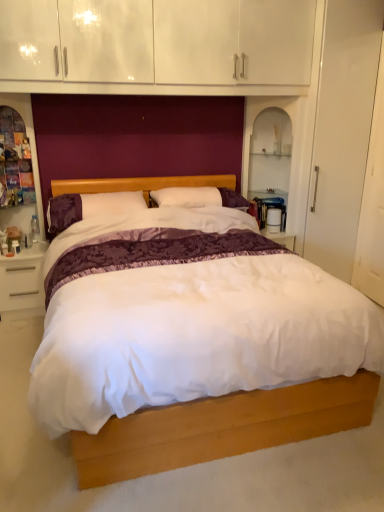
Measure the distance between purple velvet pillow at center and camera.

A distance of 2.96 meters exists between purple velvet pillow at center and camera.

Locate an element on the screen. This screenshot has height=512, width=384. white glossy nightstand at lower left is located at coordinates (22, 279).

From a real-world perspective, is white satin bed at center positioned above or below purple velvet pillow at center?

From a real-world perspective, white satin bed at center is physically below purple velvet pillow at center.

From the image's perspective, is white satin bed at center on top of purple velvet pillow at center?

No, from the image's perspective, white satin bed at center is not above purple velvet pillow at center.

Considering the relative sizes of white satin bed at center and purple velvet pillow at center in the image provided, is white satin bed at center smaller than purple velvet pillow at center?

No, white satin bed at center is not smaller than purple velvet pillow at center.

Is white satin bed at center positioned far away from purple velvet pillow at center?

That's right, there is a large distance between white satin bed at center and purple velvet pillow at center.

Is purple velvet pillow at center not near white satin bed at center?

Indeed, purple velvet pillow at center is not near white satin bed at center.

Image resolution: width=384 pixels, height=512 pixels. Identify the location of pillow located above the white satin bed at center (from the image's perspective). (88, 207).

In the image, is purple velvet pillow at center positioned in front of or behind white satin bed at center?

purple velvet pillow at center is behind white satin bed at center.

Is purple velvet pillow at center facing away from white satin bed at center?

That's right, purple velvet pillow at center is facing away from white satin bed at center.

Which object is further away from the camera taking this photo, purple velvet pillow at center or wooden dresser at left?

purple velvet pillow at center.

In terms of height, does purple velvet pillow at center look taller or shorter compared to wooden dresser at left?

Clearly, purple velvet pillow at center is shorter compared to wooden dresser at left.

Considering the relative sizes of white satin bed at center and white glossy nightstand at lower left in the image provided, is white satin bed at center wider than white glossy nightstand at lower left?

Yes.

Is white satin bed at center taller than white glossy nightstand at lower left?

Yes, white satin bed at center is taller than white glossy nightstand at lower left.

Identify the location of nightstand below the white satin bed at center (from a real-world perspective). The width and height of the screenshot is (384, 512). (22, 279).

From a real-world perspective, between white satin bed at center and white glossy nightstand at lower left, who is vertically higher?

white satin bed at center is physically above.

Is point (29, 104) positioned behind point (4, 261)?

Yes, point (29, 104) is farther from viewer.

How many degrees apart are the facing directions of wooden dresser at left and white glossy nightstand at lower left?

The facing directions of wooden dresser at left and white glossy nightstand at lower left are 0.000284 degrees apart.

Is wooden dresser at left facing towards white glossy nightstand at lower left?

No, wooden dresser at left is not oriented towards white glossy nightstand at lower left.

Is wooden dresser at left bigger than white glossy nightstand at lower left?

Yes.

How many degrees apart are the facing directions of white glossy nightstand at lower left and purple velvet pillow at center?

2.15 degrees.

Could purple velvet pillow at center be considered to be inside white glossy nightstand at lower left?

No, white glossy nightstand at lower left does not contain purple velvet pillow at center.

Considering the sizes of objects white glossy nightstand at lower left and purple velvet pillow at center in the image provided, who is wider, white glossy nightstand at lower left or purple velvet pillow at center?

Wider between the two is purple velvet pillow at center.

Between white glossy nightstand at lower left and purple velvet pillow at center, which one appears on the right side from the viewer's perspective?

purple velvet pillow at center.

Is purple velvet pillow at center wider or thinner than white glossy nightstand at lower left?

Clearly, purple velvet pillow at center has more width compared to white glossy nightstand at lower left.

Based on the photo, is purple velvet pillow at center taller than white glossy nightstand at lower left?

In fact, purple velvet pillow at center may be shorter than white glossy nightstand at lower left.

From the image's perspective, is purple velvet pillow at center above or below white glossy nightstand at lower left?

From the image's perspective, purple velvet pillow at center appears above white glossy nightstand at lower left.

Is purple velvet pillow at center facing away from white glossy nightstand at lower left?

No, purple velvet pillow at center's orientation is not away from white glossy nightstand at lower left.

This screenshot has width=384, height=512. In order to click on pillow that is above the white satin bed at center (from the image's perspective) in this screenshot , I will do `click(88, 207)`.

The height and width of the screenshot is (512, 384). What are the coordinates of `bed lying on the right of purple velvet pillow at center` in the screenshot? It's located at (221, 428).

Which object lies further to the anchor point purple velvet pillow at center, wooden dresser at left or white satin bed at center?

white satin bed at center is positioned further to the anchor purple velvet pillow at center.

Looking at the image, which one is located closer to white satin bed at center, wooden dresser at left or white glossy nightstand at lower left?

white glossy nightstand at lower left is positioned closer to the anchor white satin bed at center.

Estimate the real-world distances between objects in this image. Which object is closer to white satin bed at center, white glossy nightstand at lower left or wooden dresser at left?

white glossy nightstand at lower left.

Which object lies further to the anchor point wooden dresser at left, white satin bed at center or white glossy nightstand at lower left?

white satin bed at center is positioned further to the anchor wooden dresser at left.

Looking at this image, considering their positions, is white satin bed at center positioned further to purple velvet pillow at center than wooden dresser at left?

white satin bed at center is positioned further to the anchor purple velvet pillow at center.

Looking at the image, which one is located closer to wooden dresser at left, white glossy nightstand at lower left or white satin bed at center?

white glossy nightstand at lower left lies closer to wooden dresser at left than the other object.

Considering their positions, is purple velvet pillow at center positioned further to white glossy nightstand at lower left than wooden dresser at left?

purple velvet pillow at center lies further to white glossy nightstand at lower left than the other object.

From the image, which object appears to be farther from wooden dresser at left, purple velvet pillow at center or white glossy nightstand at lower left?

purple velvet pillow at center.

Where is `pillow between white satin bed at center and white glossy nightstand at lower left along the z-axis`? This screenshot has width=384, height=512. pillow between white satin bed at center and white glossy nightstand at lower left along the z-axis is located at coordinates (88, 207).

Locate an element on the screen. pillow between wooden dresser at left and white glossy nightstand at lower left from top to bottom is located at coordinates (88, 207).

You are a GUI agent. You are given a task and a screenshot of the screen. Output one action in this format:
    pyautogui.click(x=<x>, y=<y>)
    Task: Click on the dresser between white satin bed at center and purple velvet pillow at center in the front-back direction
    The width and height of the screenshot is (384, 512).
    Given the screenshot: What is the action you would take?
    pyautogui.click(x=24, y=231)

The width and height of the screenshot is (384, 512). Find the location of `dresser between white satin bed at center and white glossy nightstand at lower left in the front-back direction`. dresser between white satin bed at center and white glossy nightstand at lower left in the front-back direction is located at coordinates (24, 231).